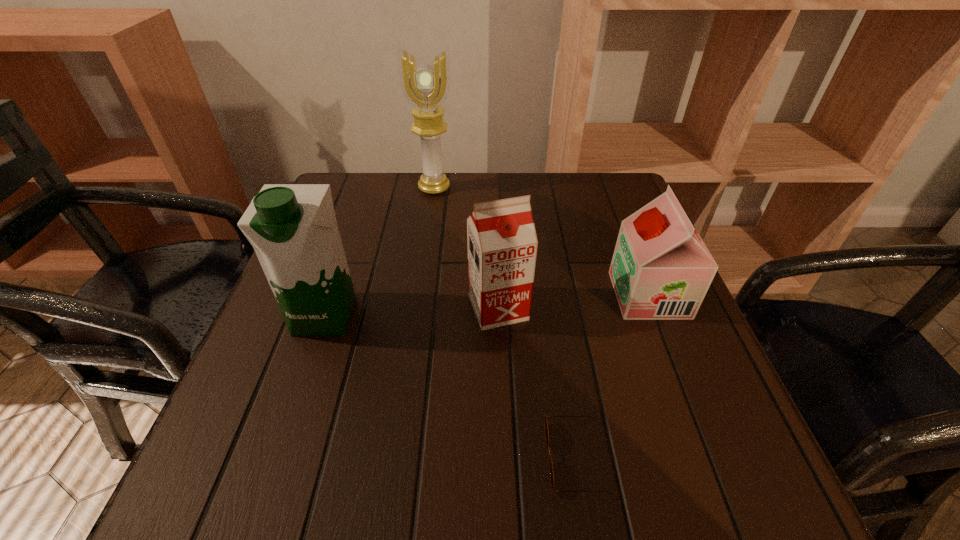
Where is `award`? The image size is (960, 540). award is located at coordinates (425, 84).

The image size is (960, 540). Identify the location of the tallest object. (425, 84).

You are a GUI agent. You are given a task and a screenshot of the screen. Output one action in this format:
    pyautogui.click(x=<x>, y=<y>)
    Task: Click on the leftmost object
    The height and width of the screenshot is (540, 960).
    Given the screenshot: What is the action you would take?
    pyautogui.click(x=293, y=229)

The width and height of the screenshot is (960, 540). Identify the location of the third object from left to right. (502, 244).

Locate an element on the screen. The width and height of the screenshot is (960, 540). the rightmost object is located at coordinates (661, 269).

At what (x,y) coordinates should I click in order to perform the action: click on the rightmost soya milk. Please return your answer as a coordinate pair (x, y). Looking at the image, I should click on (661, 269).

Identify the location of the shortest object. Image resolution: width=960 pixels, height=540 pixels. (545, 420).

Identify the location of sunglasses. The width and height of the screenshot is (960, 540). (545, 420).

This screenshot has width=960, height=540. I want to click on vacant region located 0.070m on the front-facing side of the award, so click(431, 213).

Find the location of a particular element. free location located 0.190m on the front-facing side of the leftmost soya milk is located at coordinates (282, 440).